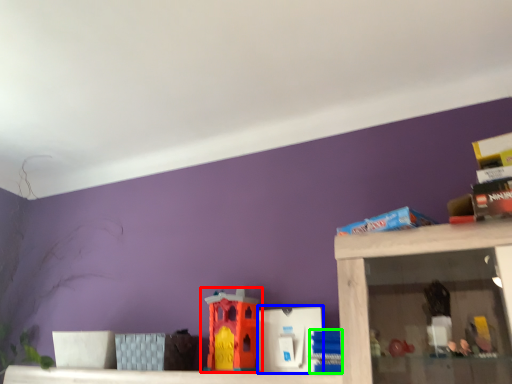
Question: Based on their relative distances, which object is farther from toy (highlighted by a red box)? Choose from toy (highlighted by a blue box) and toy (highlighted by a green box).

Choices:
 (A) toy
 (B) toy

Answer: (B)